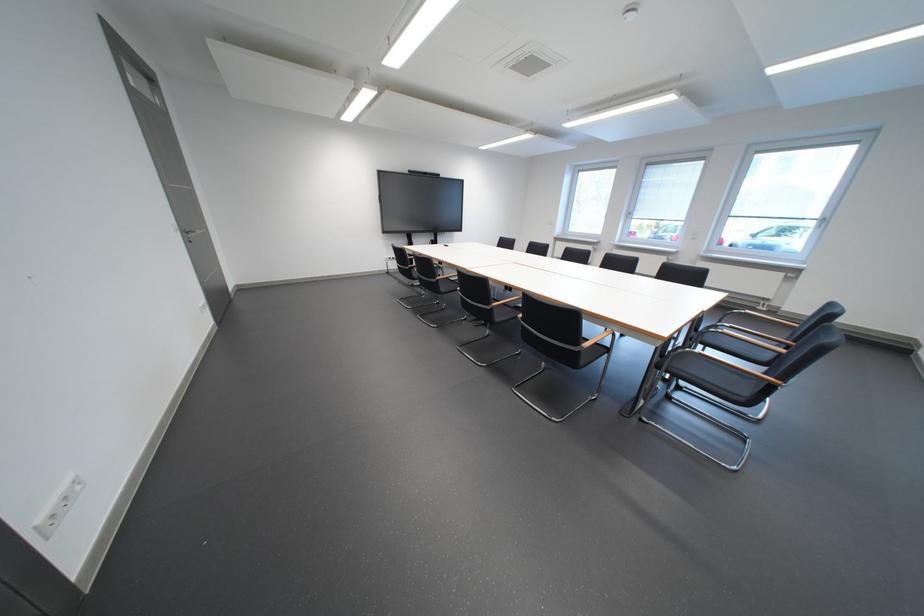
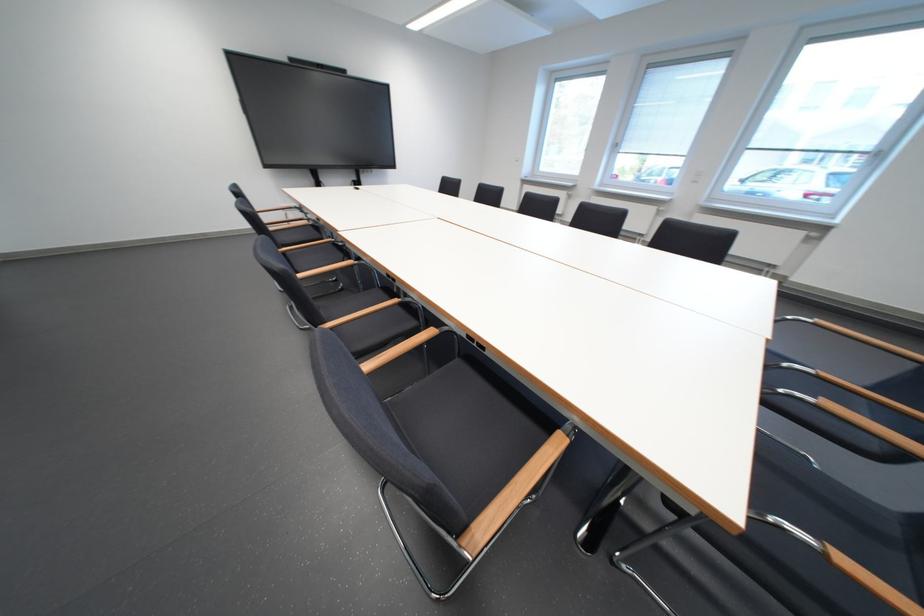
Which direction would the cameraman need to move to produce the second image?

The cameraman moved toward right, forward.